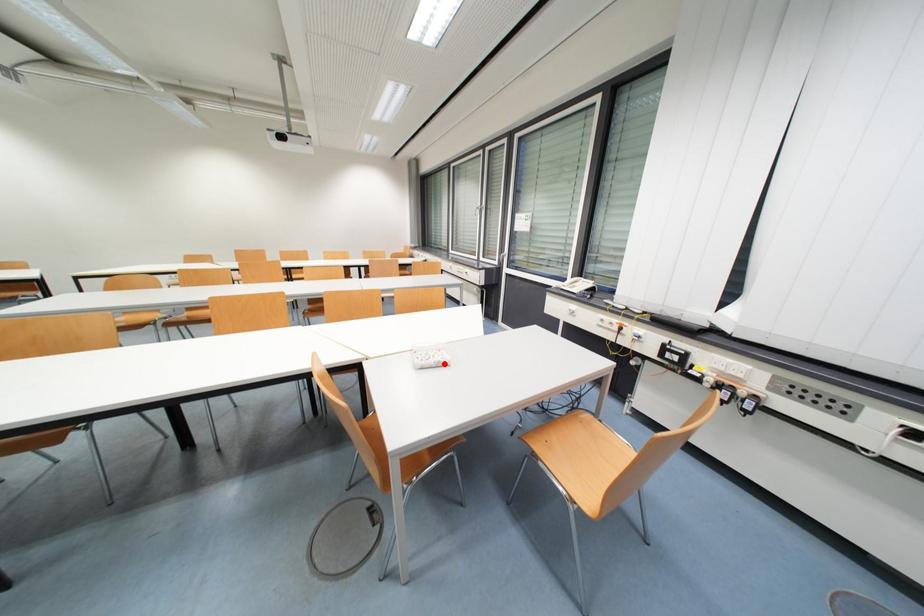
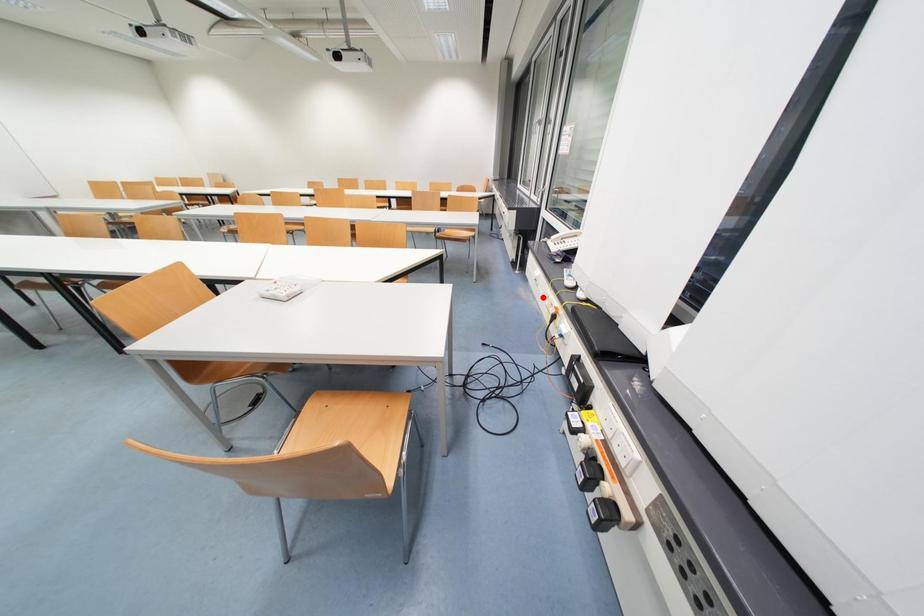
I am providing you with two images of the same scene from different viewpoints. A red point is marked on the first image and another point is marked on the second image. Are the points marked in image1 and image2 representing the same 3D position?

No